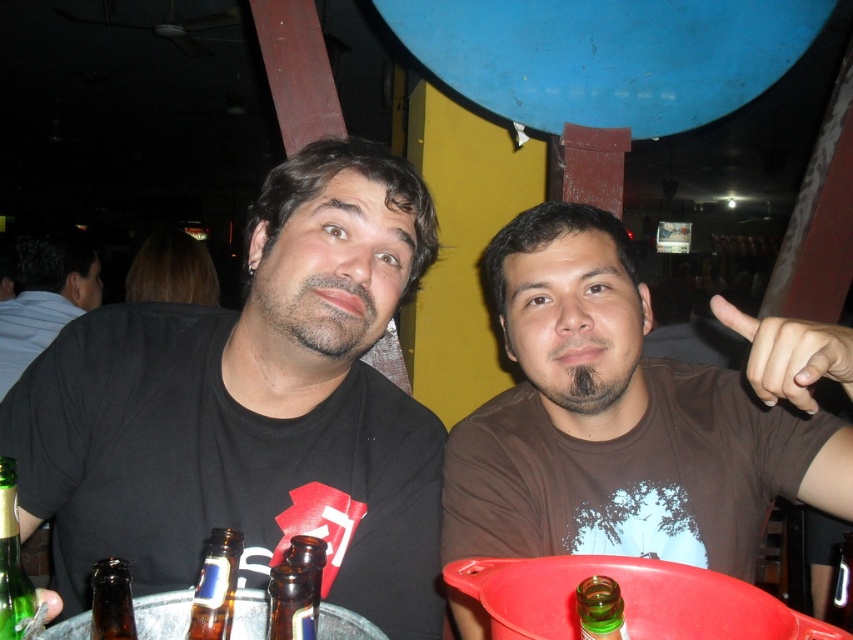
You are a fashion designer observing the scene. You need to decide which item has a greater width for a clothing line that prioritizes wider designs. Which one is wider between the black matte shirt at left and the translucent glass bottle at lower center?

The black matte shirt at left is wider than the translucent glass bottle at lower center according to the description.

You are a delivery person who needs to place a package between the black shirt at left and the green glass bottle at lower left. The package requires a minimum of 5 feet of space. Can you fit it there?

The black shirt at left and green glass bottle at lower left are 7.29 feet apart, so yes, the package can be placed between them as the distance is sufficient to meet the 5 feet requirement.